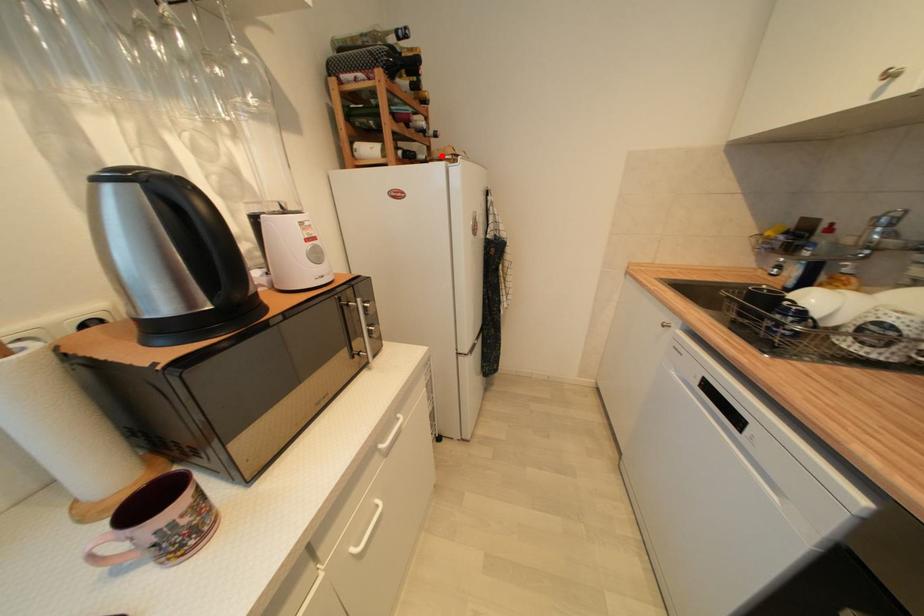
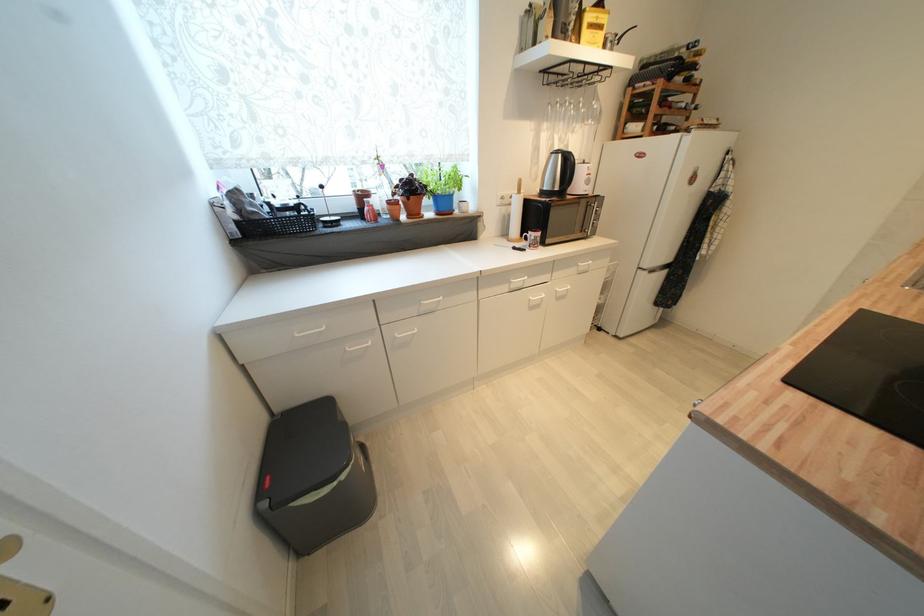
Where in the second image is the point corresponding to the highlighted location from the first image?

(690, 127)